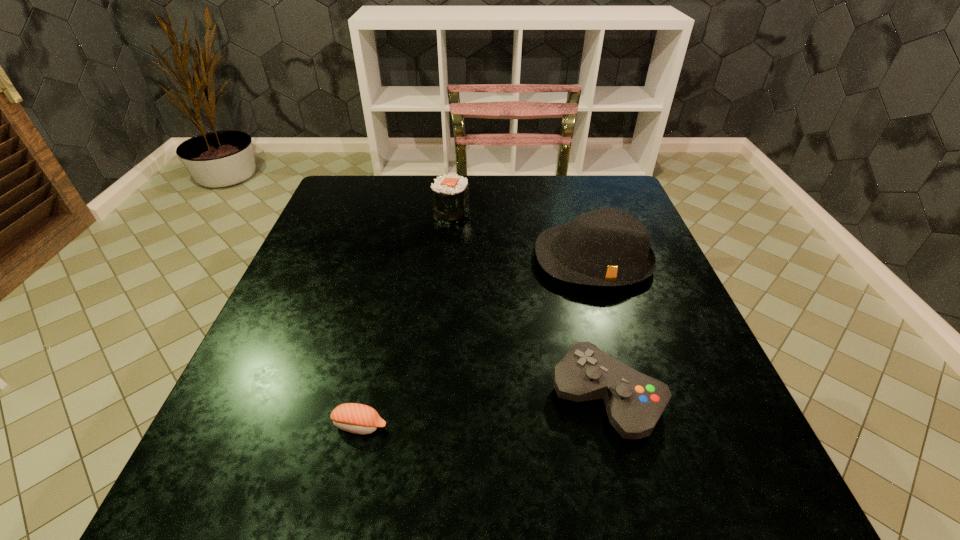
I want to click on vacant point located between the farthest object and the second shortest object, so click(529, 305).

Identify the location of free spot between the second farthest object and the third object from right to left. click(x=522, y=235).

At what (x,y) coordinates should I click in order to perform the action: click on free point between the nearer sushi and the farthest object. Please return your answer as a coordinate pair (x, y). This screenshot has width=960, height=540. Looking at the image, I should click on (405, 318).

Where is `free area in between the third tallest object and the nearer sushi`? This screenshot has height=540, width=960. free area in between the third tallest object and the nearer sushi is located at coordinates (483, 411).

What are the coordinates of `empty space between the tallest object and the control` in the screenshot? It's located at (600, 329).

Find the location of a particular element. The height and width of the screenshot is (540, 960). free point between the shorter sushi and the fedora is located at coordinates (476, 343).

The image size is (960, 540). In order to click on vacant area between the fedora and the control in this screenshot , I will do `click(600, 329)`.

Identify the location of free space between the shortest object and the taller sushi. (405, 318).

Find the location of a particular element. This screenshot has height=540, width=960. vacant area between the tallest object and the third tallest object is located at coordinates tap(600, 329).

Select which object appears as the closest to the farther sushi. Please provide its 2D coordinates. Your answer should be formatted as a tuple, i.e. [(x, y)], where the tuple contains the x and y coordinates of a point satisfying the conditions above.

[(608, 247)]